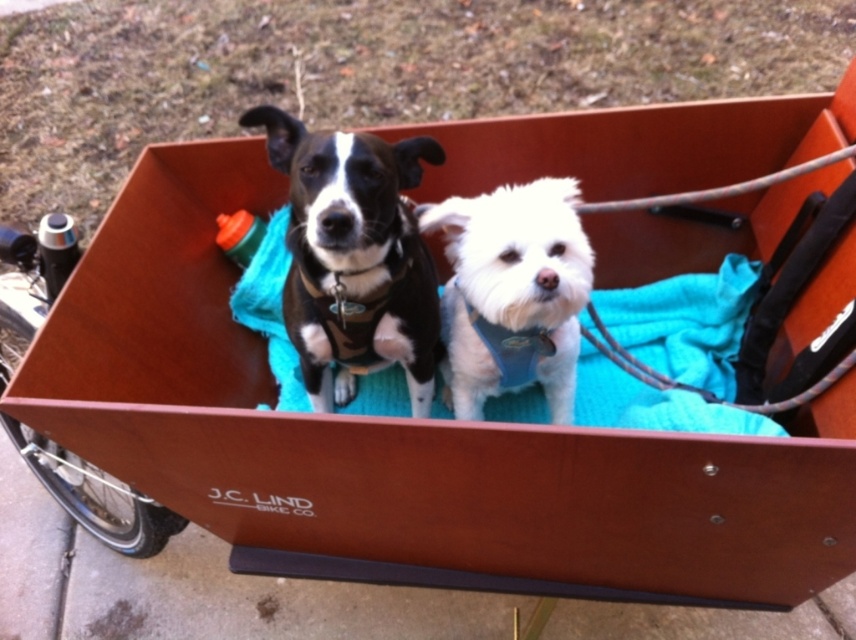
Measure the distance between point (413,369) and camera.

5.93 feet

Is black matte harness at center positioned before white fluffy dog at center?

Yes, it is in front of white fluffy dog at center.

The height and width of the screenshot is (640, 856). What are the coordinates of `black matte harness at center` in the screenshot? It's located at (354, 259).